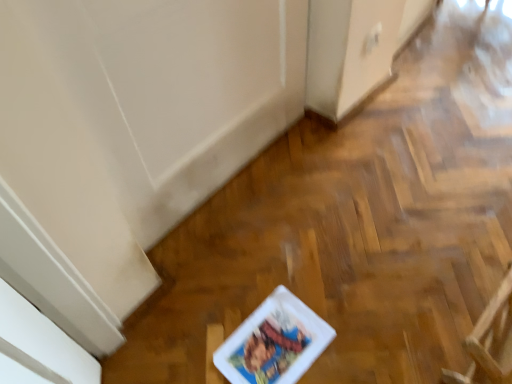
Question: Relative to white glossy comic book at center, is wooden armchair at lower right in front or behind?

Choices:
 (A) behind
 (B) front

Answer: (B)

Question: Is wooden armchair at lower right inside the boundaries of white glossy comic book at center, or outside?

Choices:
 (A) inside
 (B) outside

Answer: (B)

Question: In terms of width, does wooden armchair at lower right look wider or thinner when compared to white glossy comic book at center?

Choices:
 (A) thin
 (B) wide

Answer: (A)

Question: Looking at the image, does white glossy comic book at center seem bigger or smaller compared to wooden armchair at lower right?

Choices:
 (A) big
 (B) small

Answer: (B)

Question: In the image, is white glossy comic book at center on the left side or the right side of wooden armchair at lower right?

Choices:
 (A) right
 (B) left

Answer: (B)

Question: Do you think white glossy comic book at center is within wooden armchair at lower right, or outside of it?

Choices:
 (A) outside
 (B) inside

Answer: (A)

Question: In terms of width, does white glossy comic book at center look wider or thinner when compared to wooden armchair at lower right?

Choices:
 (A) wide
 (B) thin

Answer: (A)